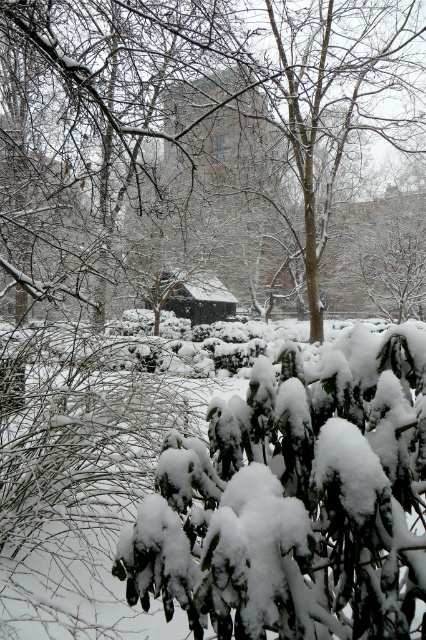
You are standing in the winter scene and want to take a photo. There are two points marked in the image, point 1 at coordinates point (244, 83) and point 2 at coordinates point (207, 314). Which point is closer to your camera?

Point (244, 83) is closer to the camera than point (207, 314).